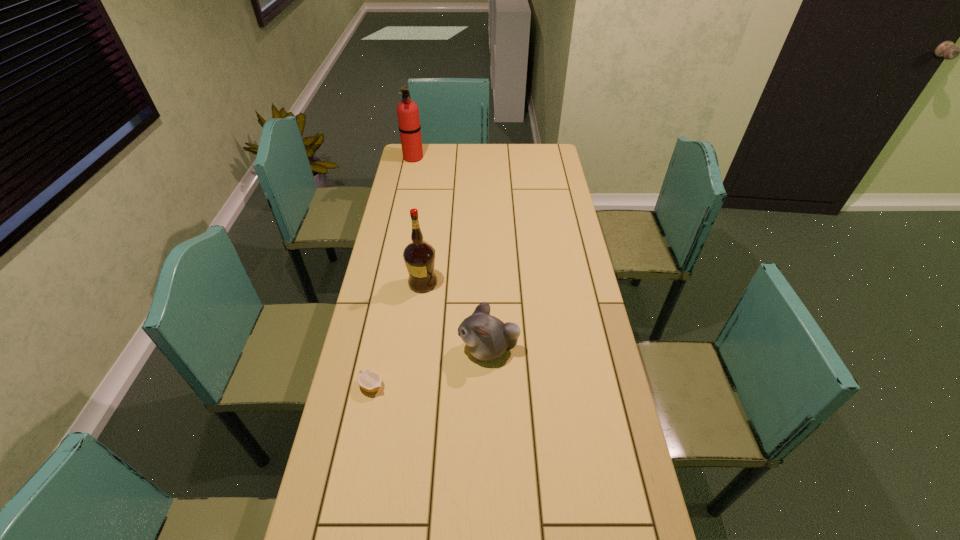
Locate an element on the screen. This screenshot has height=540, width=960. vacant space located on the face of the hamster is located at coordinates (443, 349).

Where is `free space located on the face of the hamster`? free space located on the face of the hamster is located at coordinates (417, 349).

You are a GUI agent. You are given a task and a screenshot of the screen. Output one action in this format:
    pyautogui.click(x=<x>, y=<y>)
    Task: Click on the vacant space located on the right of the nearest object
    The height and width of the screenshot is (540, 960).
    Given the screenshot: What is the action you would take?
    pyautogui.click(x=468, y=386)

You are a GUI agent. You are given a task and a screenshot of the screen. Output one action in this format:
    pyautogui.click(x=<x>, y=<y>)
    Task: Click on the object that is at the far edge
    The image size is (960, 540).
    Given the screenshot: What is the action you would take?
    pyautogui.click(x=408, y=113)

Where is `fire extinguisher present at the left edge`? This screenshot has height=540, width=960. fire extinguisher present at the left edge is located at coordinates (408, 113).

Find the location of a particular element. alcohol that is at the left edge is located at coordinates (419, 256).

You are a GUI agent. You are given a task and a screenshot of the screen. Output one action in this format:
    pyautogui.click(x=<x>, y=<y>)
    Task: Click on the lemon at the left edge
    
    Given the screenshot: What is the action you would take?
    pyautogui.click(x=369, y=380)

I want to click on object at the far left corner, so click(x=408, y=113).

Where is `blank space at the far edge of the desktop`? Image resolution: width=960 pixels, height=540 pixels. blank space at the far edge of the desktop is located at coordinates point(460,152).

In the image, there is a desktop. At what (x,y) coordinates should I click in order to perform the action: click on vacant space at the left edge. Please return your answer as a coordinate pair (x, y). The image size is (960, 540). Looking at the image, I should click on [410, 186].